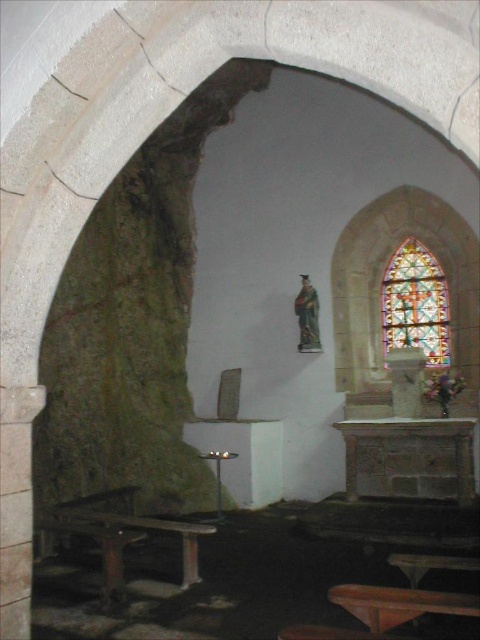
Question: Considering the relative positions of wooden picnic table at lower left and stained glass window at right in the image provided, where is wooden picnic table at lower left located with respect to stained glass window at right?

Choices:
 (A) left
 (B) right

Answer: (A)

Question: Among these objects, which one is farthest from the camera?

Choices:
 (A) wooden picnic table at lower left
 (B) stained glass window at right

Answer: (B)

Question: Does wooden picnic table at lower left have a lesser width compared to stained glass window at right?

Choices:
 (A) no
 (B) yes

Answer: (A)

Question: Which point is closer to the camera?

Choices:
 (A) wooden picnic table at lower left
 (B) stained glass window at right

Answer: (A)

Question: Can you confirm if wooden picnic table at lower left is positioned to the right of stained glass window at right?

Choices:
 (A) yes
 (B) no

Answer: (B)

Question: Which object is closer to the camera taking this photo?

Choices:
 (A) wooden picnic table at lower left
 (B) stained glass window at right

Answer: (A)